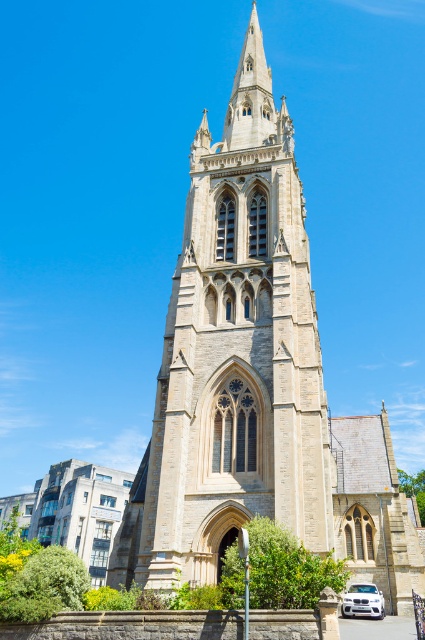
You are standing in a park and want to take a photo of the beige stone tower at center. If you are currently 37.77 meters away from it, is that the optimal distance for capturing the entire structure in one frame?

Yes, since the beige stone tower at center is 37.77 meters away from the camera, this distance is optimal for capturing the entire structure in one frame.

You are standing in front of the beige stone tower at center and want to take a photo of the white glossy car at lower right. Since the tower is between you and the car, will the tower block your view of the car?

The beige stone tower at center is closer to the viewer than the white glossy car at lower right, so the tower will block the view of the car.

You are a photographer trying to capture the beige stone tower at center and the white glossy car at lower right in the same frame. Based on their sizes, which object should you focus on to ensure both fit in the photo without cropping?

The beige stone tower at center is wider than the white glossy car at lower right, so focusing on the tower will ensure both objects fit in the frame without cropping.